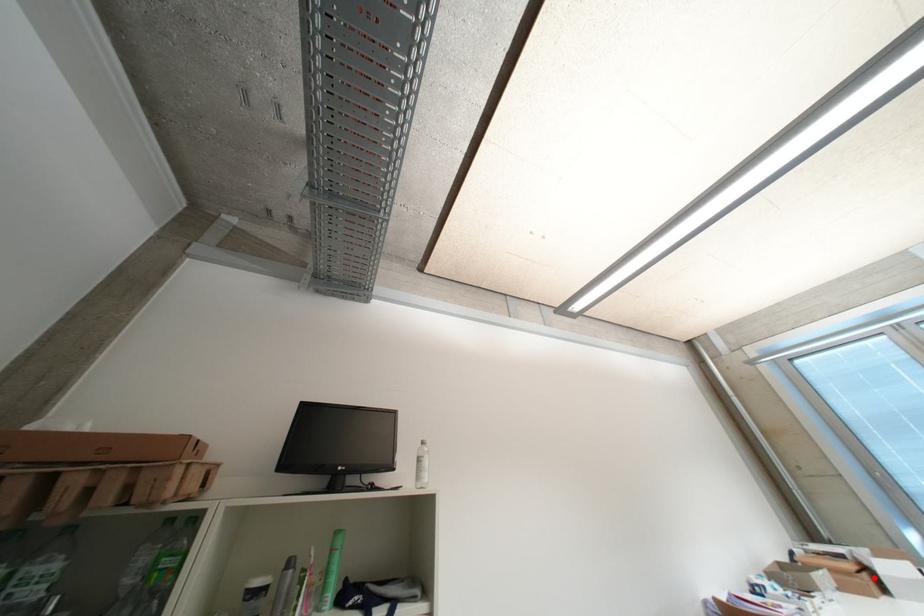
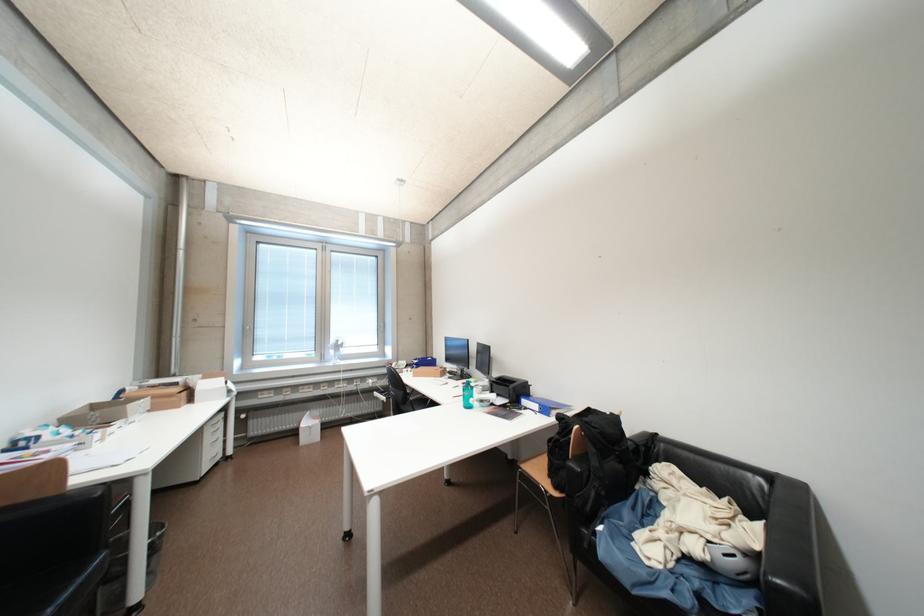
Question: I am providing you with two images of the same scene from different viewpoints. Given a red point in image1, look at the same physical point in image2. Is it:

Choices:
 (A) Closer to the viewpoint
 (B) Farther from the viewpoint

Answer: (B)